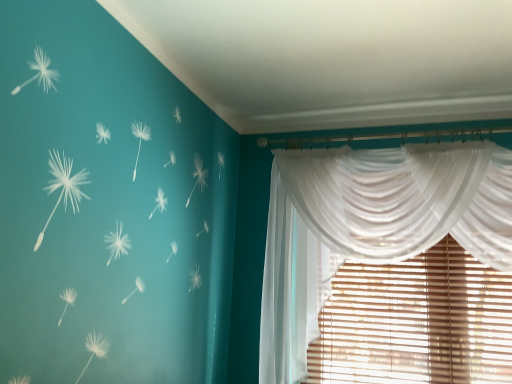
The image size is (512, 384). Describe the element at coordinates (370, 226) in the screenshot. I see `sheer white curtain at upper right` at that location.

Where is `sheer white curtain at upper right`? sheer white curtain at upper right is located at coordinates (370, 226).

What is the approximate height of sheer white curtain at upper right?

sheer white curtain at upper right is 1.22 meters tall.

The image size is (512, 384). In order to click on sheer white curtain at upper right in this screenshot , I will do `click(370, 226)`.